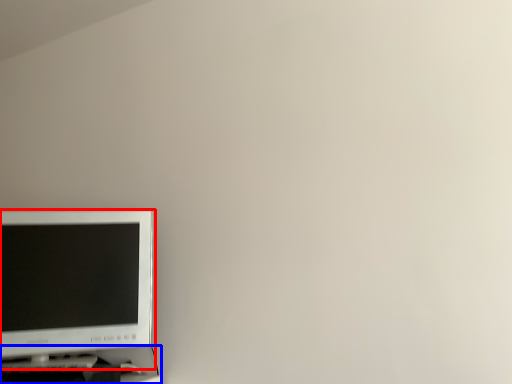
Question: Which point is closer to the camera, computer monitor (highlighted by a red box) or computer desk (highlighted by a blue box)?

Choices:
 (A) computer monitor
 (B) computer desk

Answer: (B)